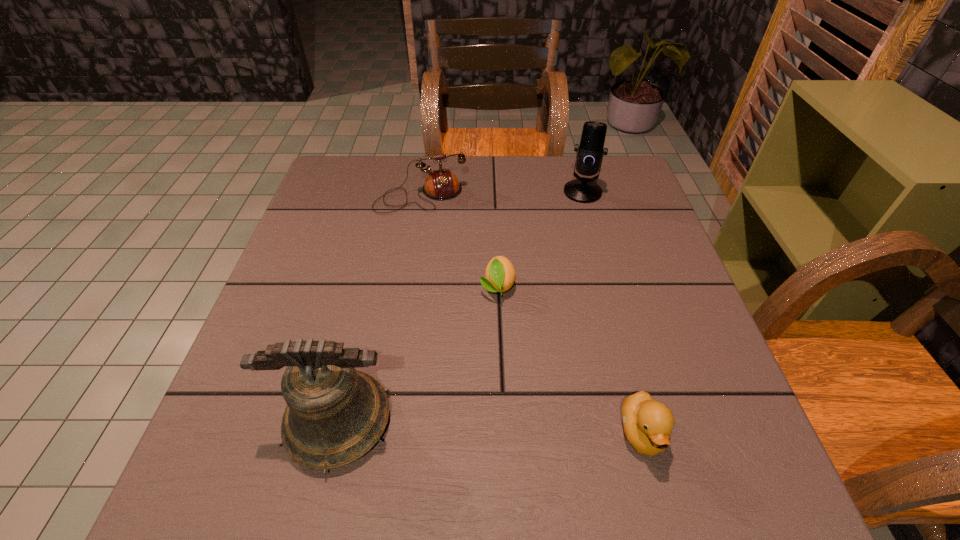
Find the location of a particular element. Image resolution: width=960 pixels, height=540 pixels. free point at the far right corner is located at coordinates (628, 167).

You are a GUI agent. You are given a task and a screenshot of the screen. Output one action in this format:
    pyautogui.click(x=<x>, y=<y>)
    Task: Click on the vacant space that is in between the third object from left to right and the duckling
    This screenshot has height=540, width=960.
    Given the screenshot: What is the action you would take?
    pyautogui.click(x=570, y=360)

Identify the location of unoccupied area between the bell and the lemon. (419, 354).

Find the location of `free space that is in between the microphone and the lemon`. free space that is in between the microphone and the lemon is located at coordinates (540, 239).

Image resolution: width=960 pixels, height=540 pixels. In order to click on vacant region between the duckling and the microphone in this screenshot , I will do `click(612, 313)`.

Where is `vacant point located between the shortest object and the telephone`? This screenshot has width=960, height=540. vacant point located between the shortest object and the telephone is located at coordinates (459, 241).

Locate an element on the screen. Image resolution: width=960 pixels, height=540 pixels. free space between the third object from right to left and the duckling is located at coordinates (570, 360).

Identify the location of vacant region between the lemon and the microphone. (540, 239).

The width and height of the screenshot is (960, 540). I want to click on vacant space that's between the duckling and the microphone, so click(x=612, y=313).

I want to click on unoccupied position between the microphone and the third object from left to right, so click(x=540, y=239).